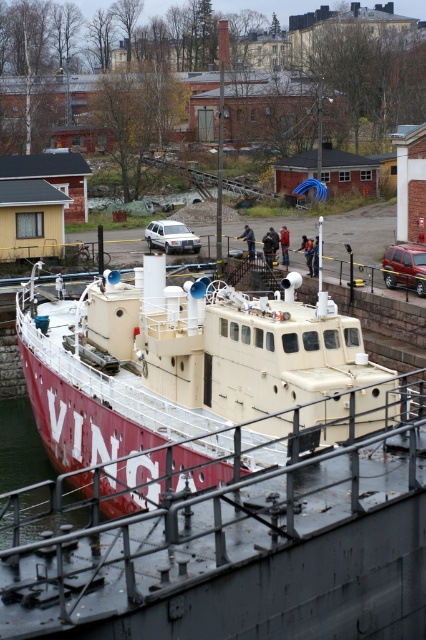
You are a dock worker who needs to secure the red matte boat at center to the dock. The boat requires a rail that is at least as wide as its own width. Is the metallic gray rail at lower center suitable for this task?

The metallic gray rail at lower center has a width larger than the red matte boat at center, so it is suitable for securing the boat.

You are a photographer standing at the dock. You want to take a photo of the red matte boat at center without including the metallic gray rail at lower center in the frame. Is this possible given their positions?

The metallic gray rail at lower center is in front of the red matte boat at center, so it would block the view. To avoid including the rail in the photo, you would need to position yourself or adjust your angle so that the rail is not between you and the boat.